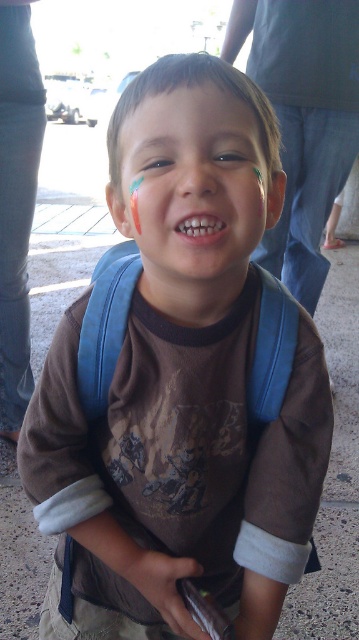
Question: Based on their relative distances, which object is farther from the matte skin forehead at center?

Choices:
 (A) matte brown face at center
 (B) brown matte eyebrow at upper center

Answer: (B)

Question: Is matte skin forehead at center below smooth skin nose at center?

Choices:
 (A) yes
 (B) no

Answer: (B)

Question: Among these objects, which one is farthest from the camera?

Choices:
 (A) brown matte eyebrow at upper center
 (B) smooth skin nose at center
 (C) matte brown face at center

Answer: (A)

Question: Is matte brown face at center in front of smooth skin nose at center?

Choices:
 (A) no
 (B) yes

Answer: (A)

Question: Among these objects, which one is nearest to the camera?

Choices:
 (A) smooth skin nose at center
 (B) white glossy teeth at center

Answer: (A)

Question: Observing the image, what is the correct spatial positioning of matte brown face at center in reference to white glossy teeth at center?

Choices:
 (A) right
 (B) left

Answer: (B)